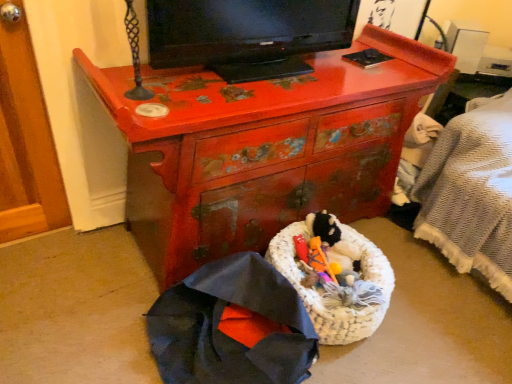
Question: Can black glossy television at upper center be found inside cherry wood dresser at center?

Choices:
 (A) yes
 (B) no

Answer: (B)

Question: Is cherry wood dresser at center aimed at black glossy television at upper center?

Choices:
 (A) yes
 (B) no

Answer: (B)

Question: Is cherry wood dresser at center not within black glossy television at upper center?

Choices:
 (A) no
 (B) yes

Answer: (B)

Question: Can you see cherry wood dresser at center touching black glossy television at upper center?

Choices:
 (A) yes
 (B) no

Answer: (B)

Question: From a real-world perspective, is cherry wood dresser at center physically below black glossy television at upper center?

Choices:
 (A) yes
 (B) no

Answer: (A)

Question: Visually, is dark blue fabric umbrella at lower left positioned to the left or to the right of black glossy television at upper center?

Choices:
 (A) right
 (B) left

Answer: (B)

Question: In the image, is dark blue fabric umbrella at lower left positioned in front of or behind black glossy television at upper center?

Choices:
 (A) front
 (B) behind

Answer: (A)

Question: Is dark blue fabric umbrella at lower left inside the boundaries of black glossy television at upper center, or outside?

Choices:
 (A) inside
 (B) outside

Answer: (B)

Question: From a real-world perspective, relative to black glossy television at upper center, is dark blue fabric umbrella at lower left vertically above or below?

Choices:
 (A) below
 (B) above

Answer: (A)

Question: Considering the positions of cherry wood dresser at center and black glossy television at upper center in the image, is cherry wood dresser at center bigger or smaller than black glossy television at upper center?

Choices:
 (A) small
 (B) big

Answer: (B)

Question: From the image's perspective, is cherry wood dresser at center located above or below black glossy television at upper center?

Choices:
 (A) below
 (B) above

Answer: (A)

Question: Relative to black glossy television at upper center, is cherry wood dresser at center in front or behind?

Choices:
 (A) behind
 (B) front

Answer: (B)

Question: From a real-world perspective, is cherry wood dresser at center above or below black glossy television at upper center?

Choices:
 (A) above
 (B) below

Answer: (B)

Question: Considering the positions of cherry wood dresser at center and white woven laundry basket at center in the image, is cherry wood dresser at center wider or thinner than white woven laundry basket at center?

Choices:
 (A) thin
 (B) wide

Answer: (B)

Question: From a real-world perspective, is cherry wood dresser at center physically located above or below white woven laundry basket at center?

Choices:
 (A) above
 (B) below

Answer: (A)